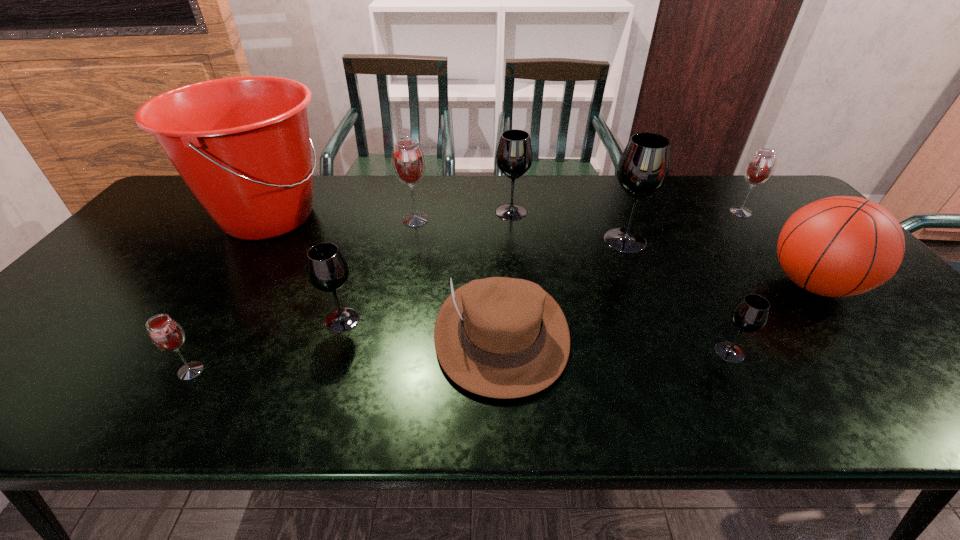
Locate an element on the screen. This screenshot has height=540, width=960. wineglass that is the closest to the eighth object from right to left is located at coordinates [x=166, y=334].

Image resolution: width=960 pixels, height=540 pixels. In order to click on gray wineglass that is the third closest to the eighth object from left to right in this screenshot , I will do `click(327, 269)`.

Locate which gray wineglass ranks in proximity to the basketball. Please provide its 2D coordinates. Your answer should be formatted as a tuple, i.e. [(x, y)], where the tuple contains the x and y coordinates of a point satisfying the conditions above.

[(750, 314)]

Where is `red wineglass that is the second closest one to the smallest gray wineglass`? This screenshot has height=540, width=960. red wineglass that is the second closest one to the smallest gray wineglass is located at coordinates (408, 160).

Image resolution: width=960 pixels, height=540 pixels. Find the location of `the second closest red wineglass to the nearest red wineglass`. the second closest red wineglass to the nearest red wineglass is located at coordinates (760, 167).

I want to click on free space that satisfies the following two spatial constraints: 1. on the front side of the rightmost gray wineglass; 2. on the left side of the biggest red wineglass, so click(389, 352).

Image resolution: width=960 pixels, height=540 pixels. Identify the location of free space that satisfies the following two spatial constraints: 1. on the back side of the leftmost red wineglass; 2. on the right side of the second biggest gray wineglass. [x=287, y=212].

This screenshot has width=960, height=540. Identify the location of vacant space that satisfies the following two spatial constraints: 1. on the back side of the tallest wineglass; 2. with the handle attached to the rim of the tallest object. (615, 217).

The image size is (960, 540). Find the location of `vacant area that satisfies the following two spatial constraints: 1. on the front side of the basketball; 2. on the right side of the rightmost wineglass`. vacant area that satisfies the following two spatial constraints: 1. on the front side of the basketball; 2. on the right side of the rightmost wineglass is located at coordinates (800, 285).

At what (x,y) coordinates should I click in order to perform the action: click on free space in the image that satisfies the following two spatial constraints: 1. with the handle attached to the rim of the tallest object; 2. on the left side of the third gray wineglass from left to right. Please return your answer as a coordinate pair (x, y). Looking at the image, I should click on (253, 240).